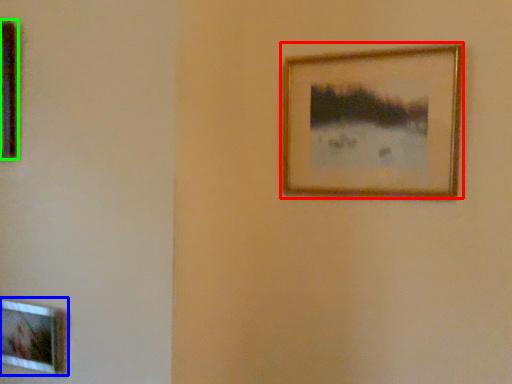
Question: Which object is the farthest from picture frame (highlighted by a red box)? Choose among these: picture frame (highlighted by a blue box) or picture frame (highlighted by a green box).

Choices:
 (A) picture frame
 (B) picture frame

Answer: (A)